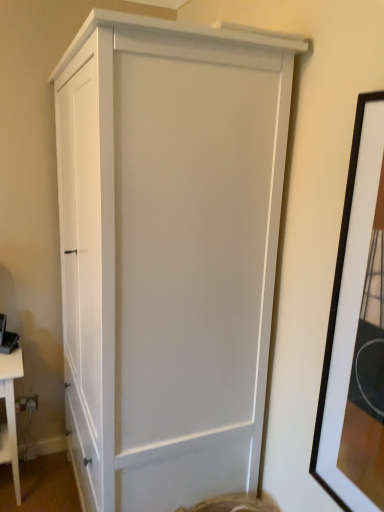
Question: From their relative heights in the image, would you say white matte cabinet at center is taller or shorter than white matte table at lower left?

Choices:
 (A) tall
 (B) short

Answer: (A)

Question: Relative to white matte table at lower left, is white matte cabinet at center in front or behind?

Choices:
 (A) front
 (B) behind

Answer: (A)

Question: Estimate the real-world distances between objects in this image. Which object is closer to the white matte table at lower left?

Choices:
 (A) black matte picture frame at right
 (B) white matte cabinet at center

Answer: (B)

Question: Based on their relative distances, which object is nearer to the black matte picture frame at right?

Choices:
 (A) white matte table at lower left
 (B) white matte cabinet at center

Answer: (B)